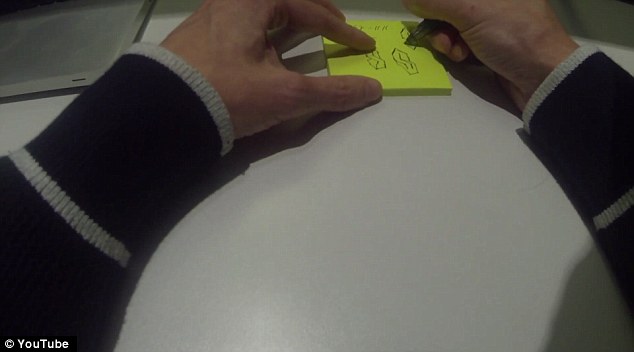
Identify the location of papers. point(85,44).